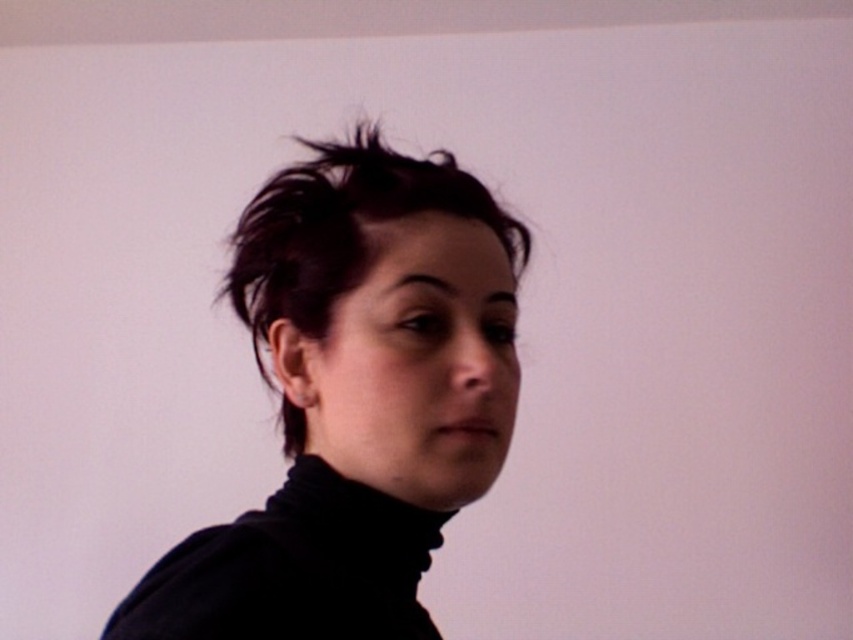
You are a photographer adjusting the camera to capture the matte black turtleneck at center. The camera has a minimum focusing distance of 12 inches. Can you take a clear photo without moving the camera closer?

The matte black turtleneck at center and camera are 14.41 inches apart from each other, which is beyond the camera minimum focusing distance of 12 inches. Therefore, you can take a clear photo without moving the camera closer.

You are a fashion designer who needs to create a matching accessory for the person in the image. Given that the matte black turtleneck at center is thinner than the dark brown hair at center, which object should you consider the width of the accessory to complement?

The matte black turtleneck at center is thinner than the dark brown hair at center, so to create a complementary accessory, you should consider the width of the matte black turtleneck at center to ensure proportionate balance with the thinner element.